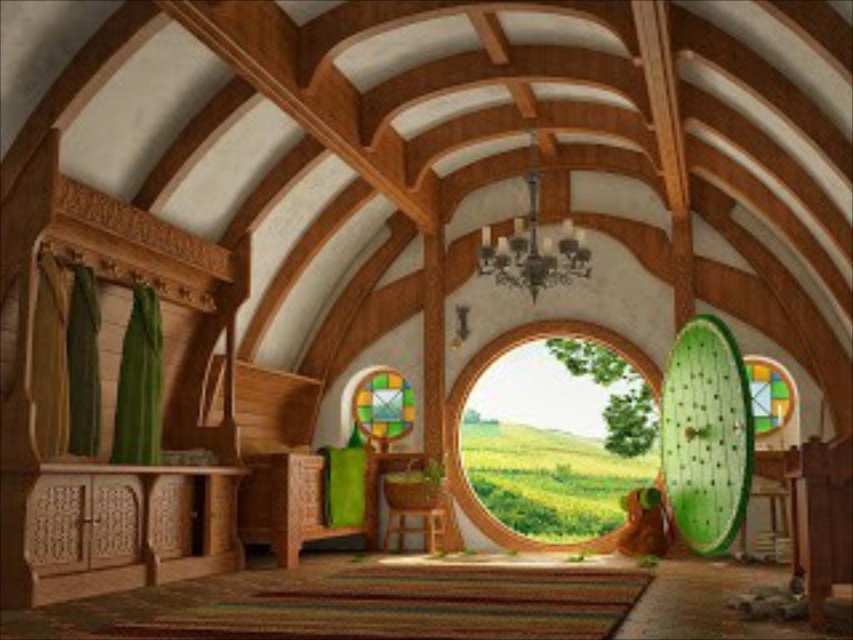
Which is more to the right, metallic chandelier at center or wooden chair at center?

metallic chandelier at center is more to the right.

Between point (537, 234) and point (393, 518), which one is positioned in front?

Point (393, 518)

This screenshot has height=640, width=853. Identify the location of metallic chandelier at center. (532, 244).

Who is positioned more to the left, wooden circle at center or metallic chandelier at center?

Positioned to the left is metallic chandelier at center.

Between point (647, 360) and point (485, 227), which one is positioned behind?

The point (647, 360) is more distant.

This screenshot has width=853, height=640. I want to click on wooden circle at center, so click(468, 397).

In the scene shown: Who is positioned more to the left, wooden circle at center or wooden chair at center?

From the viewer's perspective, wooden chair at center appears more on the left side.

Does wooden circle at center have a smaller size compared to wooden chair at center?

No.

Which is behind, point (511, 349) or point (428, 522)?

The point (511, 349) is more distant.

The height and width of the screenshot is (640, 853). Identify the location of wooden circle at center. (468, 397).